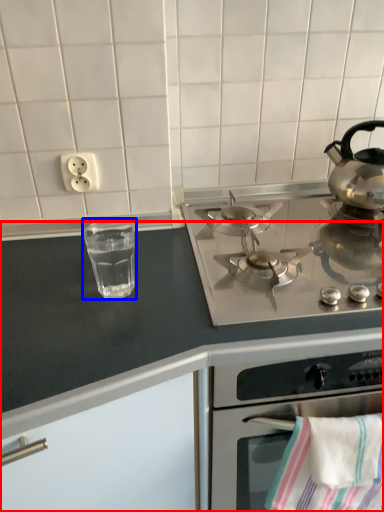
Question: Among these objects, which one is nearest to the camera, countertop (highlighted by a red box) or glass jar (highlighted by a blue box)?

Choices:
 (A) countertop
 (B) glass jar

Answer: (A)